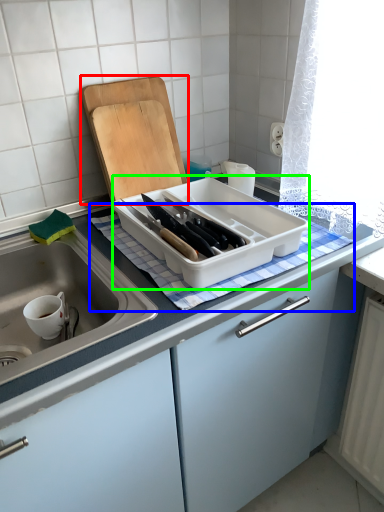
Question: Which object is the farthest from cutting board (highlighted by a red box)? Choose among these: tablecloth (highlighted by a blue box) or kitchen appliance (highlighted by a green box).

Choices:
 (A) tablecloth
 (B) kitchen appliance

Answer: (A)